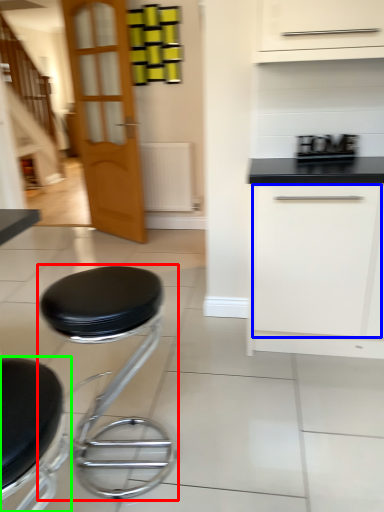
Question: Which object is the closest to the stool (highlighted by a red box)? Choose among these: drawer (highlighted by a blue box) or stool (highlighted by a green box).

Choices:
 (A) drawer
 (B) stool

Answer: (B)